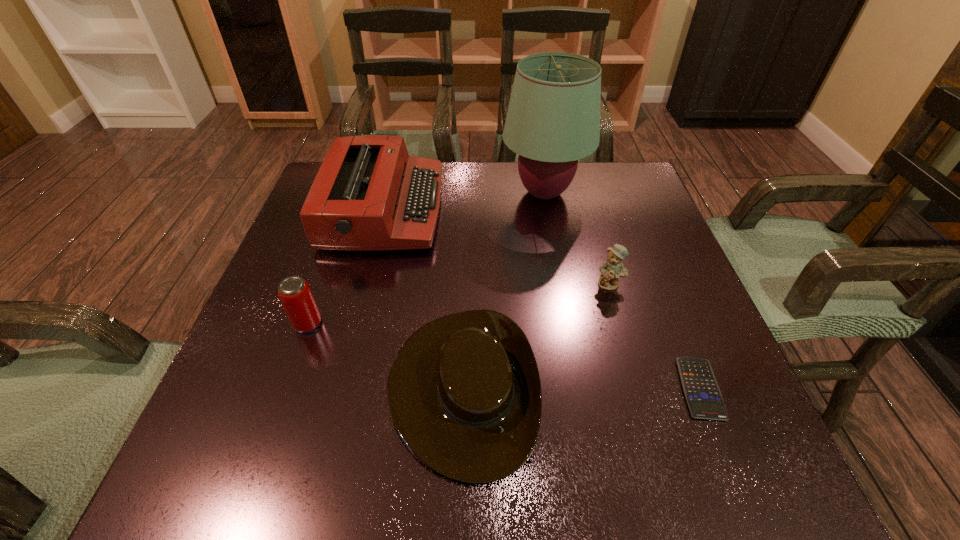
Find the location of a particular element. calculator that is at the right edge is located at coordinates (701, 390).

At what (x,y) coordinates should I click in order to perform the action: click on object present at the far left corner. Please return your answer as a coordinate pair (x, y). This screenshot has width=960, height=540. Looking at the image, I should click on (369, 194).

Find the location of a particular element. The image size is (960, 540). object at the far right corner is located at coordinates (553, 120).

Find the location of `free space at the far edge of the desktop`. free space at the far edge of the desktop is located at coordinates (457, 167).

Find the location of `vacant space at the near edge of the desktop`. vacant space at the near edge of the desktop is located at coordinates (353, 437).

You are a GUI agent. You are given a task and a screenshot of the screen. Output one action in this format:
    pyautogui.click(x=<x>, y=<y>)
    Task: Click on the vacant region at the left edge of the desktop
    Image resolution: width=960 pixels, height=540 pixels.
    Given the screenshot: What is the action you would take?
    pyautogui.click(x=264, y=345)

You are a GUI agent. You are given a task and a screenshot of the screen. Output one action in this format:
    pyautogui.click(x=<x>, y=<y>)
    Task: Click on the free region at the right edge
    The image size is (960, 540).
    Given the screenshot: What is the action you would take?
    pyautogui.click(x=676, y=323)

In the image, there is a desktop. Where is `vacant space at the far right corner`? The height and width of the screenshot is (540, 960). vacant space at the far right corner is located at coordinates (593, 165).

The height and width of the screenshot is (540, 960). In order to click on free space that is in between the shortest object and the typewriter in this screenshot , I will do `click(542, 299)`.

Locate an element on the screen. vacant space in between the rightmost object and the teddy bear is located at coordinates (655, 336).